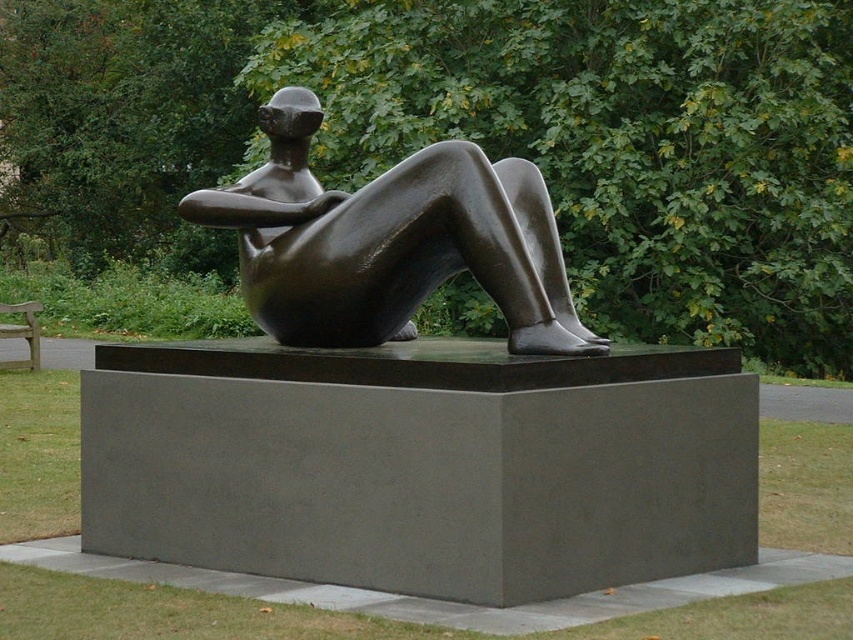
Question: Among these objects, which one is farthest from the camera?

Choices:
 (A) wooden park bench at left
 (B) bronze sculpture at center

Answer: (A)

Question: Observing the image, what is the correct spatial positioning of bronze sculpture at center in reference to wooden park bench at left?

Choices:
 (A) below
 (B) above

Answer: (B)

Question: Is bronze sculpture at center bigger than wooden park bench at left?

Choices:
 (A) no
 (B) yes

Answer: (B)

Question: Which object is closer to the camera taking this photo?

Choices:
 (A) wooden park bench at left
 (B) bronze sculpture at center

Answer: (B)

Question: Which point is closer to the camera?

Choices:
 (A) wooden park bench at left
 (B) bronze sculpture at center

Answer: (B)

Question: Is bronze sculpture at center closer to camera compared to wooden park bench at left?

Choices:
 (A) no
 (B) yes

Answer: (B)